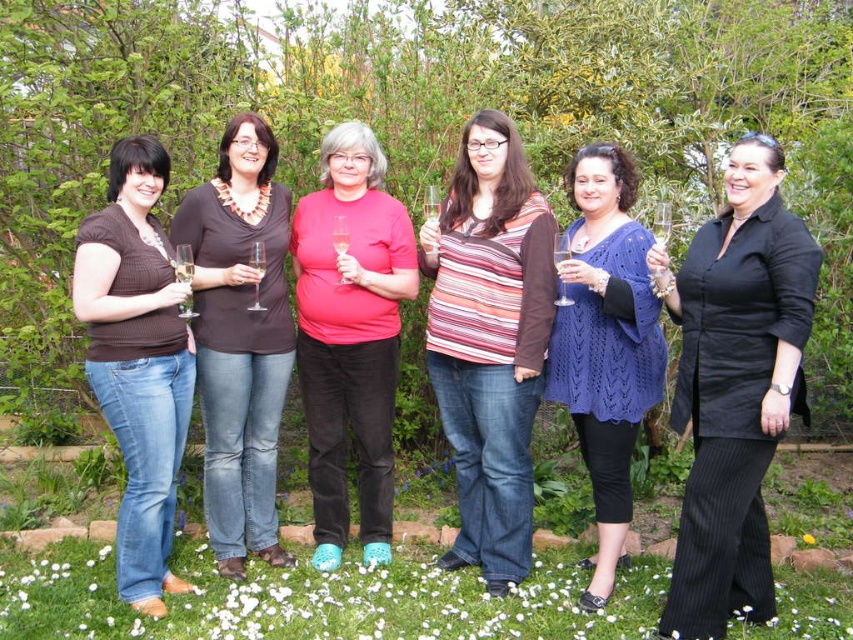
You are a photographer planning to take a group photo of the women in the garden. You notice the striped knit top at center and the matte brown blouse at center. Which of these two tops would appear larger in the photo?

The striped knit top at center would appear larger in the photo because it is bigger than the matte brown blouse at center.